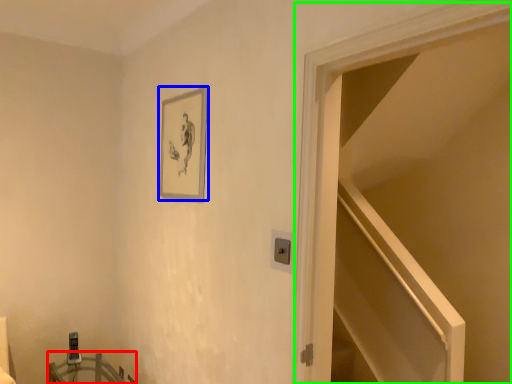
Question: Which object is positioned farthest from table (highlighted by a red box)? Select from picture frame (highlighted by a blue box) and door (highlighted by a green box).

Choices:
 (A) picture frame
 (B) door

Answer: (B)